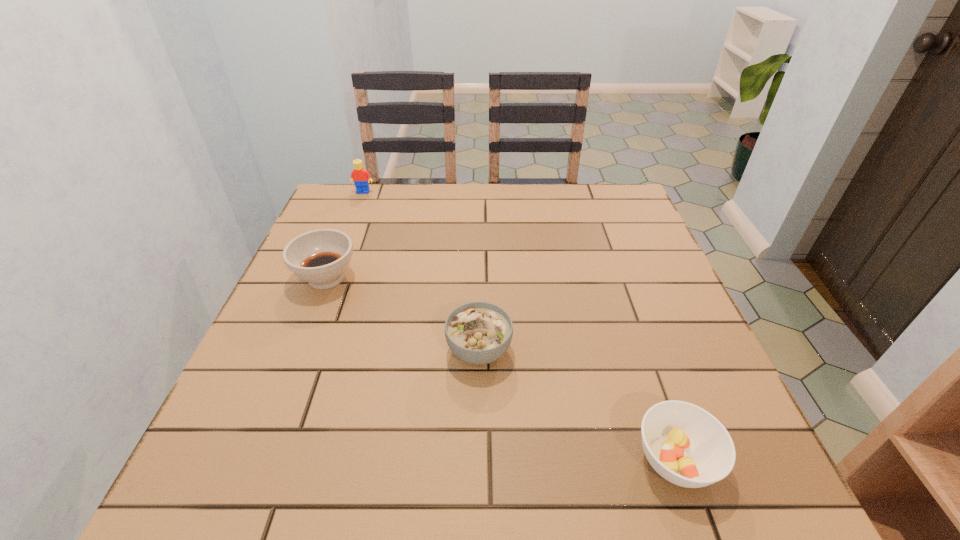
The height and width of the screenshot is (540, 960). I want to click on the tallest object, so click(x=361, y=177).

At what (x,y) coordinates should I click in order to perform the action: click on the farthest object. Please return your answer as a coordinate pair (x, y). Looking at the image, I should click on (361, 177).

In order to click on the farthest soup bowl in this screenshot , I will do `click(320, 257)`.

The height and width of the screenshot is (540, 960). In order to click on the leftmost soup bowl in this screenshot , I will do `click(320, 257)`.

In order to click on the second soup bowl from right to left in this screenshot , I will do `click(478, 333)`.

Image resolution: width=960 pixels, height=540 pixels. I want to click on the third object from left to right, so click(x=478, y=333).

I want to click on the rightmost object, so click(x=686, y=445).

Where is `the shortest soup bowl`? the shortest soup bowl is located at coordinates (686, 445).

The image size is (960, 540). Find the location of `vacant space located 0.370m on the face of the tallest object`. vacant space located 0.370m on the face of the tallest object is located at coordinates (332, 271).

Find the location of a particular element. The image size is (960, 540). vacant space located 0.120m on the back of the leftmost soup bowl is located at coordinates (345, 231).